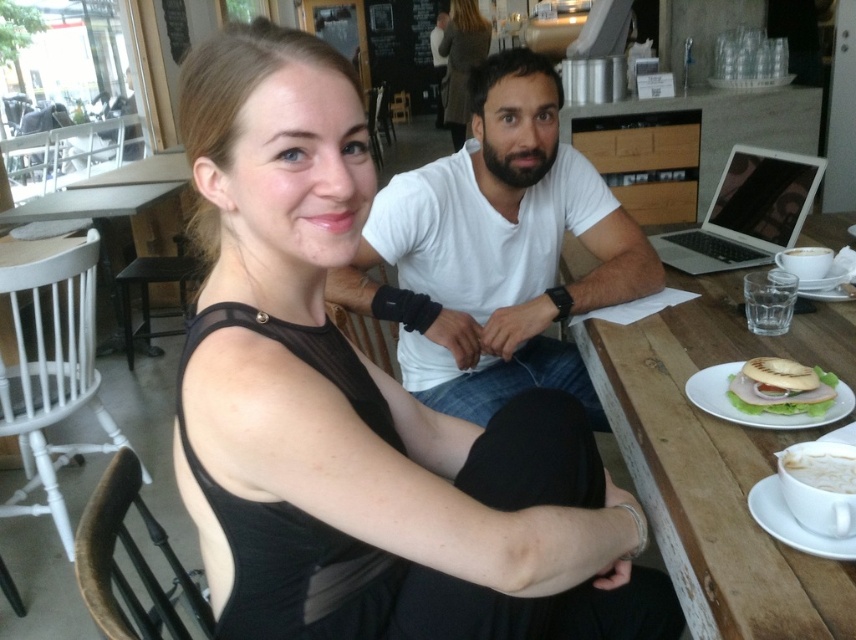
Question: Does white cotton shirt at center appear on the right side of wooden table at center?

Choices:
 (A) no
 (B) yes

Answer: (A)

Question: Considering the real-world distances, which object is farthest from the black mesh top at upper center?

Choices:
 (A) white cotton shirt at center
 (B) white matte cup at upper right
 (C) silver metallic laptop at upper right

Answer: (B)

Question: Which object appears farthest from the camera in this image?

Choices:
 (A) wooden table at center
 (B) white frothy coffee at lower right
 (C) white matte cup at upper right
 (D) black mesh top at upper center

Answer: (D)

Question: Which object is positioned closest to the black mesh dress at center?

Choices:
 (A) black mesh top at upper center
 (B) wooden table at center

Answer: (B)

Question: Does black mesh dress at center appear on the right side of white matte cup at upper right?

Choices:
 (A) no
 (B) yes

Answer: (A)

Question: Observing the image, what is the correct spatial positioning of black mesh dress at center in reference to white frothy coffee at lower right?

Choices:
 (A) right
 (B) left

Answer: (B)